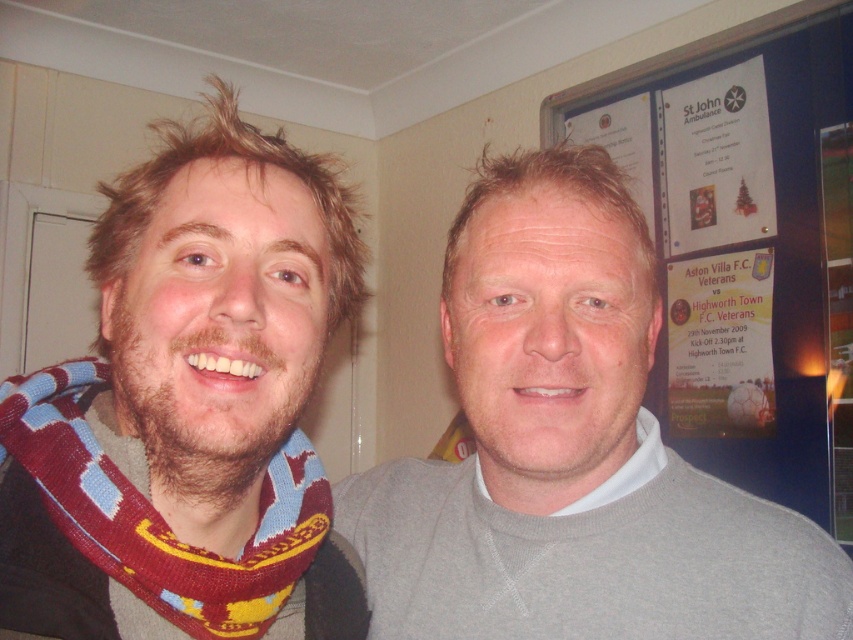
From the picture: Is gray matte sweater at center behind white paper poster at upper right?

No, it is not.

You are a GUI agent. You are given a task and a screenshot of the screen. Output one action in this format:
    pyautogui.click(x=<x>, y=<y>)
    Task: Click on the gray matte sweater at center
    The image size is (853, 640).
    Given the screenshot: What is the action you would take?
    pyautogui.click(x=572, y=451)

Describe the element at coordinates (572, 451) in the screenshot. I see `gray matte sweater at center` at that location.

Locate an element on the screen. gray matte sweater at center is located at coordinates (572, 451).

Can you confirm if gray matte sweater at center is smaller than maroon knitted scarf at left?

Actually, gray matte sweater at center might be larger than maroon knitted scarf at left.

How much distance is there between gray matte sweater at center and maroon knitted scarf at left?

The distance of gray matte sweater at center from maroon knitted scarf at left is 19.99 centimeters.

Is point (717, 588) closer to camera compared to point (70, 524)?

No, (717, 588) is behind (70, 524).

What are the coordinates of `gray matte sweater at center` in the screenshot? It's located at (572, 451).

Can you confirm if knitted scarf at left is taller than white paper poster at upper right?

No.

Consider the image. Is knitted scarf at left shorter than white paper poster at upper right?

Yes, knitted scarf at left is shorter than white paper poster at upper right.

Who is more distant from viewer, (x=74, y=376) or (x=694, y=204)?

Positioned behind is point (x=694, y=204).

Find the location of a particular element. This screenshot has height=640, width=853. knitted scarf at left is located at coordinates [x=189, y=406].